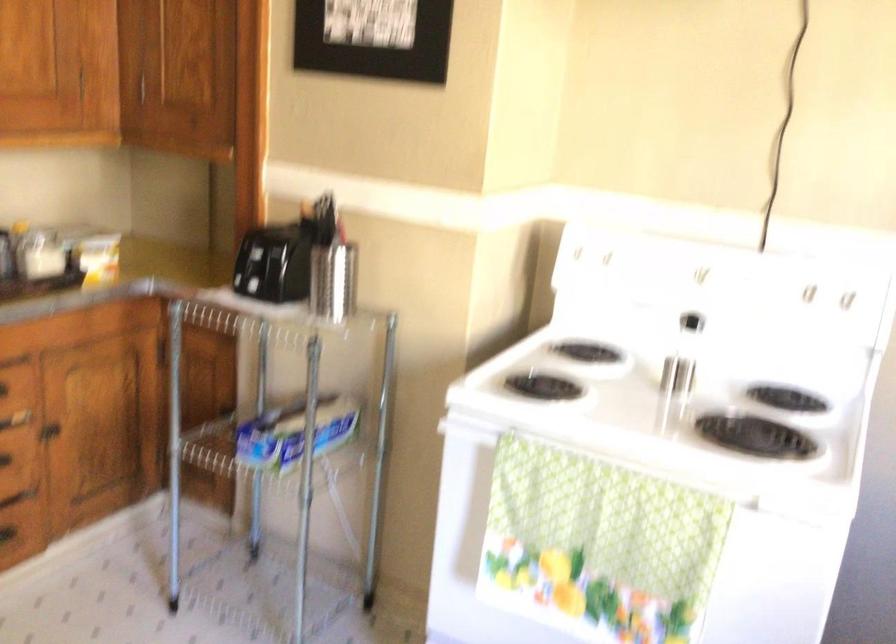
What do you see at coordinates (48, 431) in the screenshot?
I see `the cabinet door handle` at bounding box center [48, 431].